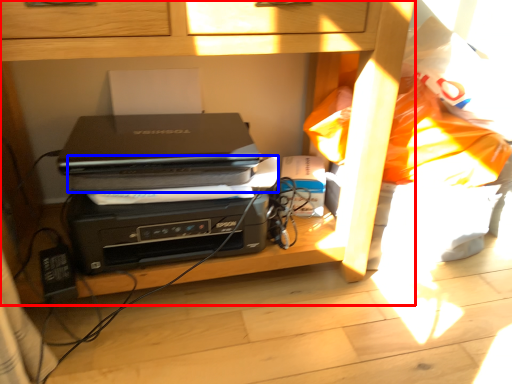
Question: Which point is closer to the camera, furniture (highlighted by a red box) or paperback book (highlighted by a blue box)?

Choices:
 (A) furniture
 (B) paperback book

Answer: (A)